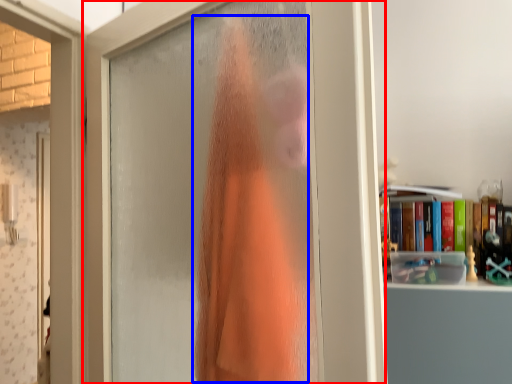
Question: Which of the following is the farthest to the observer, door (highlighted by a red box) or clothing (highlighted by a blue box)?

Choices:
 (A) door
 (B) clothing

Answer: (B)